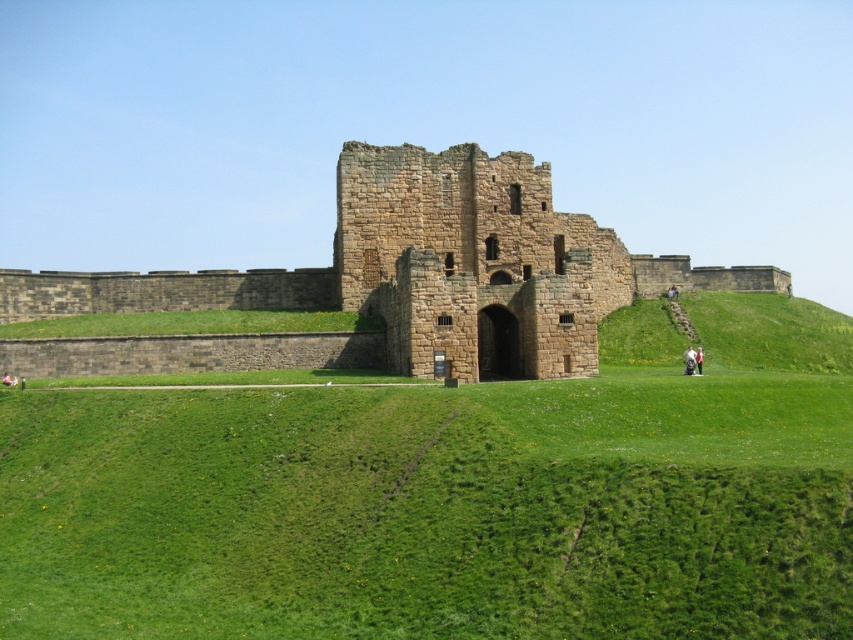
Question: Does green grassy at center appear on the right side of brown stone castle at center?

Choices:
 (A) no
 (B) yes

Answer: (A)

Question: Is the position of green grassy at center less distant than that of brown stone castle at center?

Choices:
 (A) yes
 (B) no

Answer: (A)

Question: Which object is closer to the camera taking this photo?

Choices:
 (A) brown stone castle at center
 (B) green grassy at center

Answer: (B)

Question: Which point is farther from the camera taking this photo?

Choices:
 (A) [x=474, y=204]
 (B) [x=196, y=461]

Answer: (A)

Question: Which point is closer to the camera taking this photo?

Choices:
 (A) (466, 284)
 (B) (128, 620)

Answer: (B)

Question: Is green grassy at center thinner than brown stone castle at center?

Choices:
 (A) no
 (B) yes

Answer: (B)